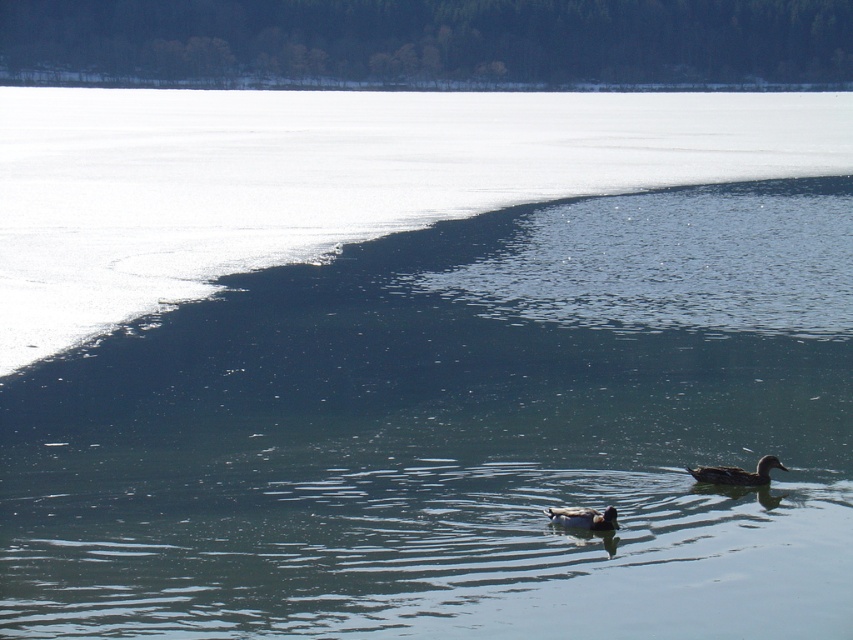
Question: Which of the following is the closest to the observer?

Choices:
 (A) (564, 515)
 (B) (703, 467)

Answer: (A)

Question: Does brown glossy duck at lower right appear on the left side of brown matte duck at center?

Choices:
 (A) no
 (B) yes

Answer: (A)

Question: Among these objects, which one is nearest to the camera?

Choices:
 (A) brown glossy duck at lower right
 (B) brown matte duck at center

Answer: (B)

Question: Can you confirm if brown glossy duck at lower right is positioned above brown matte duck at center?

Choices:
 (A) yes
 (B) no

Answer: (A)

Question: Considering the relative positions of brown glossy duck at lower right and brown matte duck at center in the image provided, where is brown glossy duck at lower right located with respect to brown matte duck at center?

Choices:
 (A) left
 (B) right

Answer: (B)